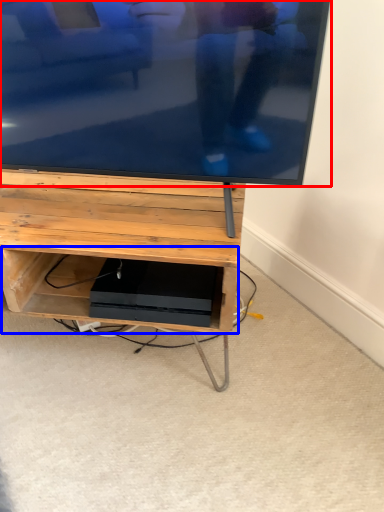
Question: Which of the following is the closest to the observer, television (highlighted by a red box) or shelf (highlighted by a blue box)?

Choices:
 (A) television
 (B) shelf

Answer: (A)